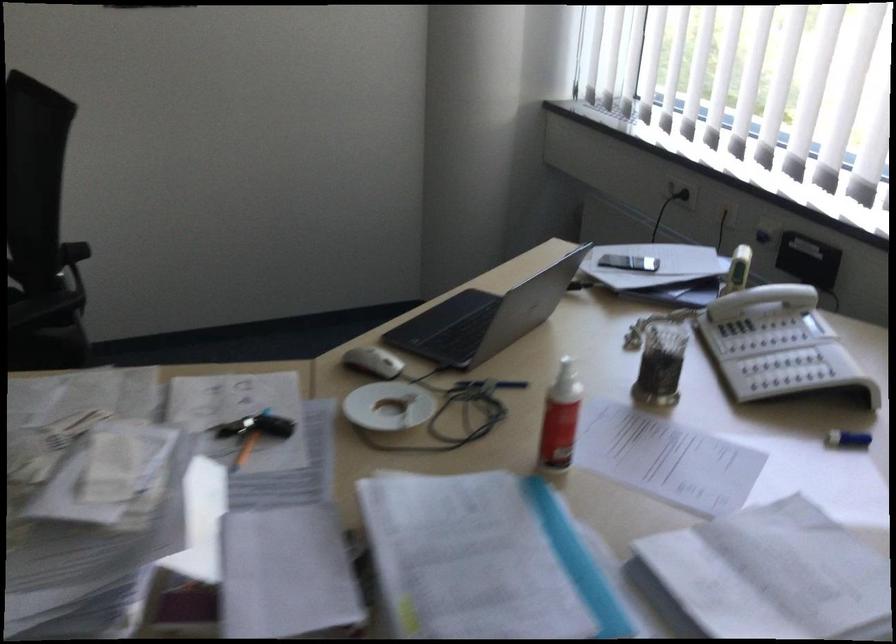
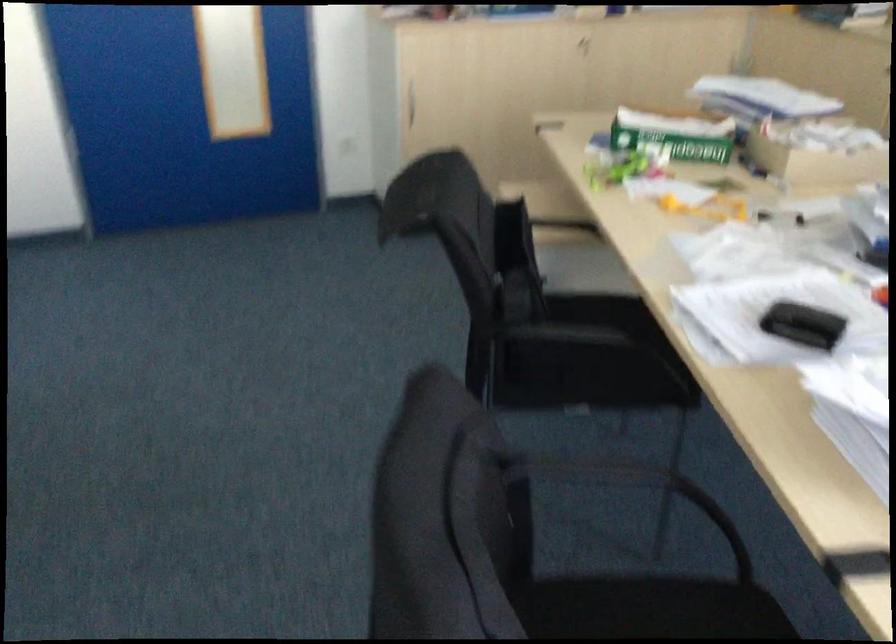
The images are taken continuously from a first-person perspective. In which direction is your viewpoint rotating?

The camera rotated toward left-down.